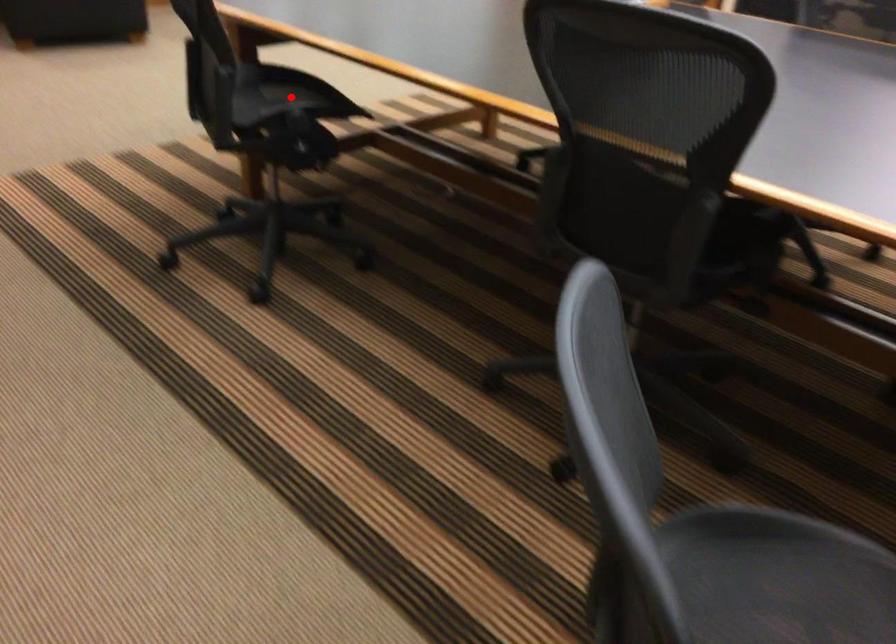
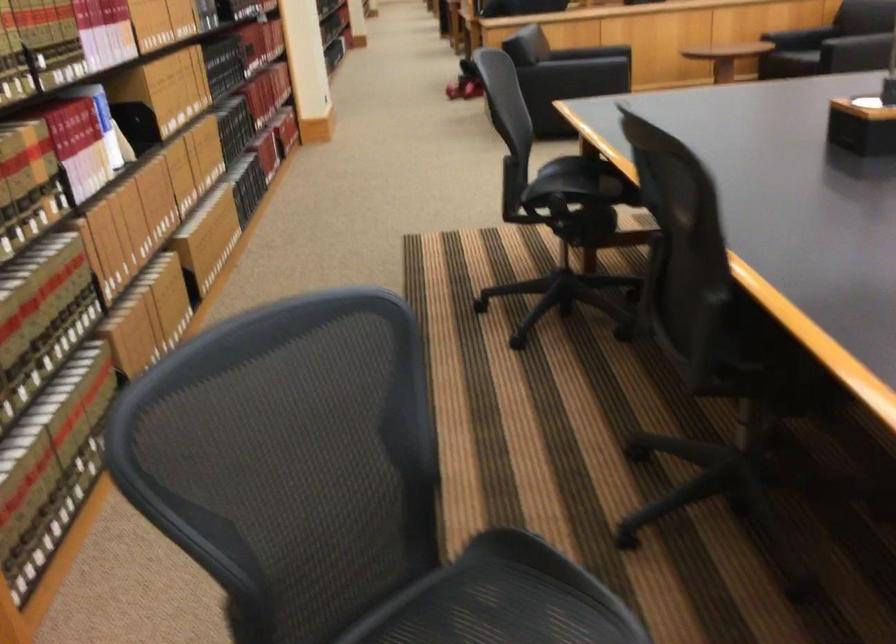
Question: I am providing you with two images of the same scene from different viewpoints. In image1, a red point is highlighted. Considering the same 3D point in image2, which of the following is correct?

Choices:
 (A) It is closer
 (B) It is farther

Answer: (B)